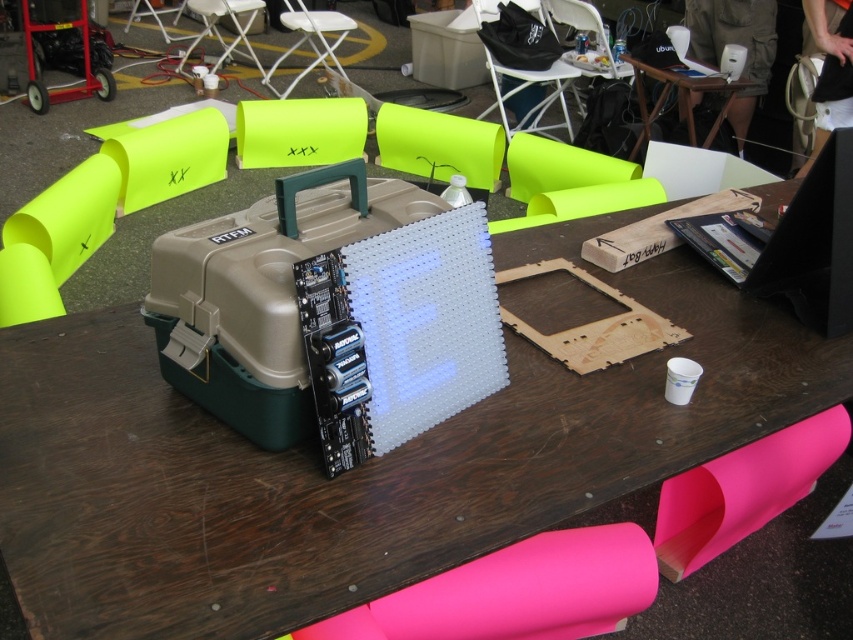
You are setting up for an event and need to place a large equipment box that requires a stable surface. The equipment box has dimensions of 1 meter by 1 meter. Given the brown wood table at center is at coordinates point 0.731, 0.422, can the equipment box fit on the table?

The brown wood table at center is located at point (358, 467). However, without knowing the table dimensions, it is impossible to determine if the equipment box will fit. Please provide more information about the table size.

You are setting up a display for an event and need to place a 15cm tall electronic component on a table. The component must be placed on a table that is taller than the other. Which table should you choose between the brown wood table at center and the wooden table at upper center?

The brown wood table at center is taller than the wooden table at upper center, so the electronic component should be placed on the brown wood table at center.

You are setting up for an event and need to place a large banner between the brown wood table at center and the wooden table at upper center. According to the scene description, which table should the banner be placed closer to if you want it nearer to the left side of the setup?

The banner should be placed closer to the brown wood table at center because it is located to the left of the wooden table at upper center, so positioning it near the left side would mean being closer to the brown wood table at center.